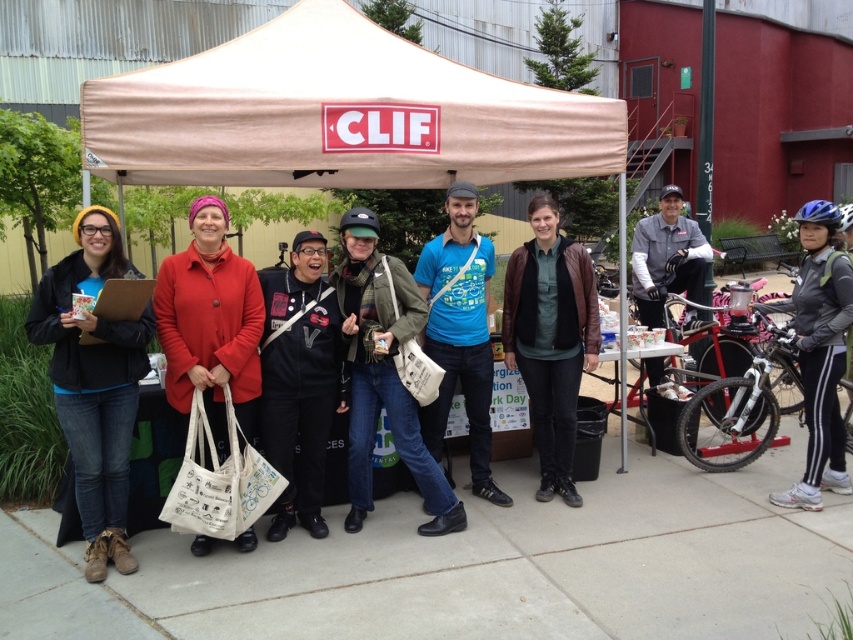
Between point (299, 10) and point (82, 285), which one is positioned behind?

The point (299, 10) is behind.

Does point (555, 93) come farther from viewer compared to point (62, 260)?

Yes, point (555, 93) is farther from viewer.

You are a GUI agent. You are given a task and a screenshot of the screen. Output one action in this format:
    pyautogui.click(x=<x>, y=<y>)
    Task: Click on the beige fabric canopy at center
    Image resolution: width=853 pixels, height=640 pixels.
    Given the screenshot: What is the action you would take?
    pyautogui.click(x=338, y=115)

Based on the photo, between concrete sidewalk at center and green canvas bag at center, which one has less height?

With less height is concrete sidewalk at center.

What do you see at coordinates (483, 566) in the screenshot?
I see `concrete sidewalk at center` at bounding box center [483, 566].

Is point (821, 516) positioned in front of point (421, 310)?

No, it is behind (421, 310).

Find the location of a particular element. The height and width of the screenshot is (640, 853). concrete sidewalk at center is located at coordinates pos(483,566).

Between point (103, 531) and point (457, 340), which one is positioned in front?

Point (103, 531)

Which is behind, point (122, 396) or point (489, 356)?

The point (489, 356) is more distant.

Does point (96, 228) lie behind point (480, 266)?

No, (96, 228) is closer to viewer.

This screenshot has width=853, height=640. Find the location of `matte black jacket at left`. matte black jacket at left is located at coordinates (94, 384).